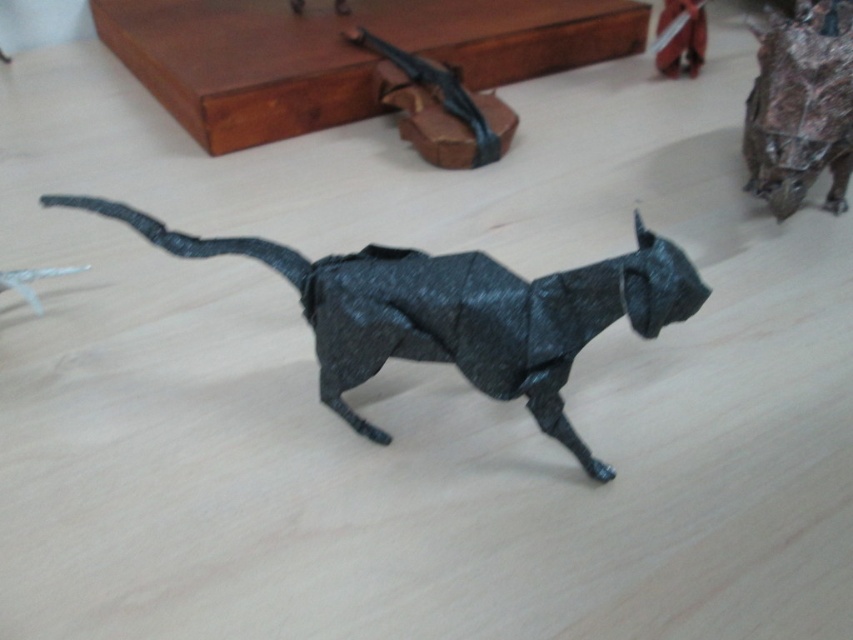
You are holding a small toy that is 1 foot in length and want to place it on the surface where the rustic brown paper bag at upper right is located. Can the toy fit on that surface without overlapping the bag?

The distance of rustic brown paper bag at upper right from viewer is 4.53 feet. Since the toy is only 1 foot long, there should be enough space on the surface to place it without overlapping the bag, provided there are no other obstructions.